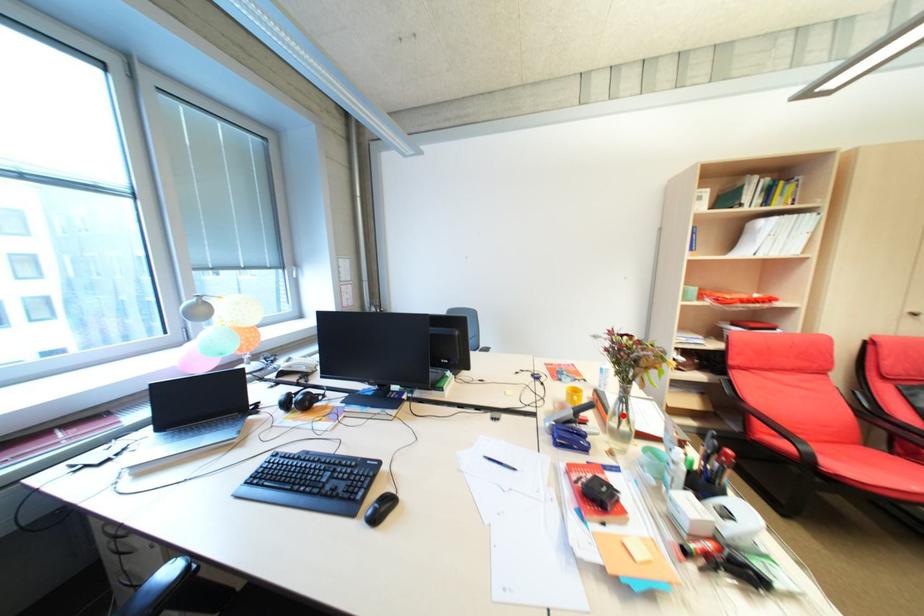
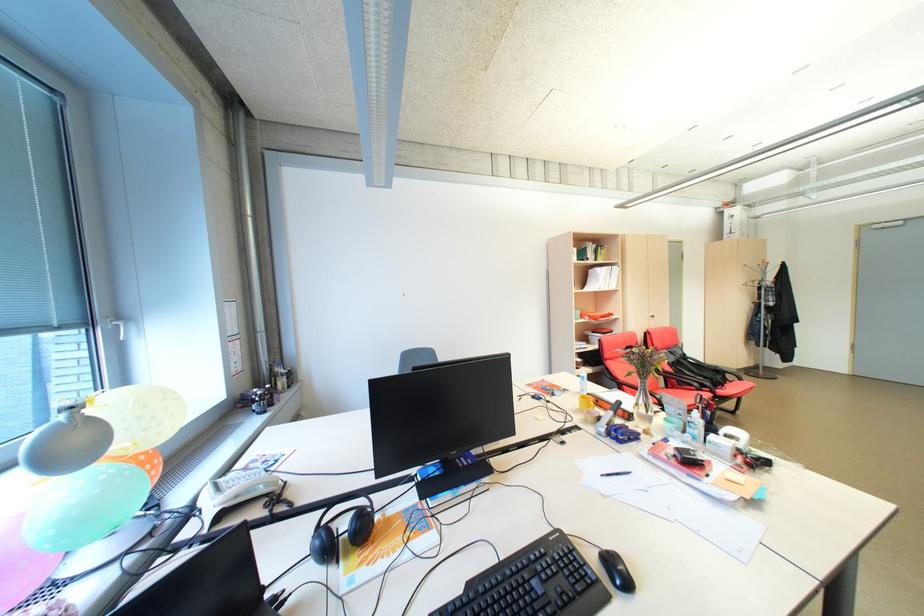
Question: I am providing you with two images of the same scene from different viewpoints. A red point is shown in image1. For the corresponding object point in image2, is it positioned nearer or farther from the camera?

Choices:
 (A) Nearer
 (B) Farther

Answer: (A)